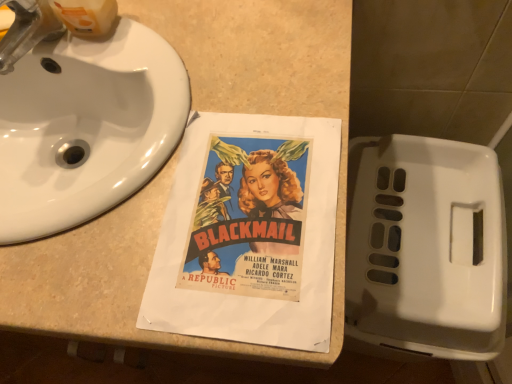
Question: Relative to white glossy sink at upper left, is brushed metal faucet at upper left in front or behind?

Choices:
 (A) front
 (B) behind

Answer: (B)

Question: Choose the correct answer: Is brushed metal faucet at upper left inside white glossy sink at upper left or outside it?

Choices:
 (A) inside
 (B) outside

Answer: (B)

Question: Estimate the real-world distances between objects in this image. Which object is farther from the white plastic toilet at lower right?

Choices:
 (A) beige laminate counter at center
 (B) white glossy sink at upper left
 (C) brushed metal faucet at upper left

Answer: (C)

Question: Which object is positioned closest to the beige laminate counter at center?

Choices:
 (A) white glossy sink at upper left
 (B) white plastic toilet at lower right
 (C) brushed metal faucet at upper left

Answer: (A)